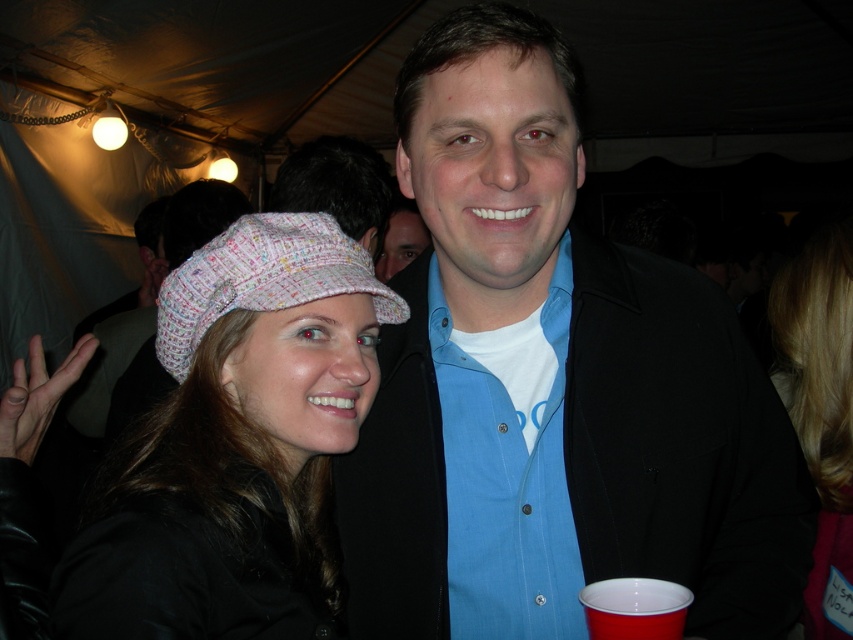
Looking at this image, you are standing at the center of the tent and see the point at coordinates (235, 445). Which object is this point located on?

The point at coordinates (235, 445) is located on the textured knit hat at left.

You are at a social gathering under a tent and notice two features in the foreground. The first is a textured knit hat at left, and the second is blonde hair at center. Which of these two items occupies a larger area in the image?

The blonde hair at center occupies a larger area in the image than the textured knit hat at left.